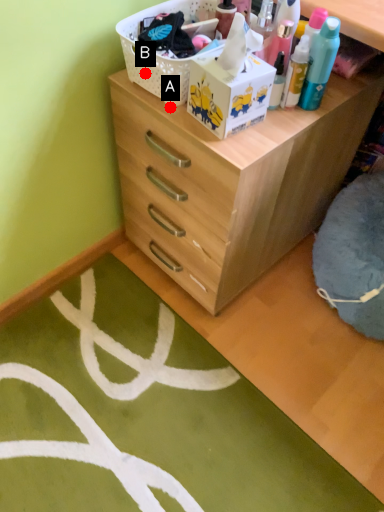
Question: Two points are circled on the image, labeled by A and B beside each circle. Which point appears closest to the camera in this image?

Choices:
 (A) A is closer
 (B) B is closer

Answer: (B)